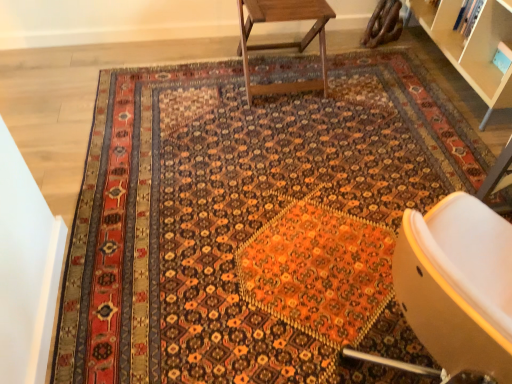
In the scene shown: In order to face matte orange chair at lower right, should I rotate leftwards or rightwards?

Turn right approximately 26.873 degrees to face it.

Describe the element at coordinates (458, 285) in the screenshot. I see `matte orange chair at lower right` at that location.

Locate an element on the screen. matte orange chair at lower right is located at coordinates (458, 285).

I want to click on wooden table at upper center, so click(x=284, y=43).

What do you see at coordinates (284, 43) in the screenshot? I see `wooden table at upper center` at bounding box center [284, 43].

The width and height of the screenshot is (512, 384). Find the location of `matte orange chair at lower right`. matte orange chair at lower right is located at coordinates (458, 285).

Would you say matte orange chair at lower right is to the left or to the right of wooden table at upper center in the picture?

Based on their positions, matte orange chair at lower right is located to the right of wooden table at upper center.

Which object is further away from the camera, matte orange chair at lower right or wooden table at upper center?

wooden table at upper center is behind.

Does point (393, 256) appear closer or farther from the camera than point (315, 82)?

Point (393, 256).

From the picture: From the image's perspective, does matte orange chair at lower right appear lower than wooden table at upper center?

Yes, from the image's perspective, matte orange chair at lower right is beneath wooden table at upper center.

From a real-world perspective, is matte orange chair at lower right located beneath wooden table at upper center?

No, from a real-world perspective, matte orange chair at lower right is not under wooden table at upper center.

Considering the sizes of objects matte orange chair at lower right and wooden table at upper center in the image provided, who is thinner, matte orange chair at lower right or wooden table at upper center?

wooden table at upper center is thinner.

Who is taller, matte orange chair at lower right or wooden table at upper center?

With more height is matte orange chair at lower right.

Considering the relative sizes of matte orange chair at lower right and wooden table at upper center in the image provided, is matte orange chair at lower right smaller than wooden table at upper center?

No.

Would you say matte orange chair at lower right is inside or outside wooden table at upper center?

matte orange chair at lower right is not enclosed by wooden table at upper center.

In the scene shown: Is matte orange chair at lower right positioned far away from wooden table at upper center?

matte orange chair at lower right is far away from wooden table at upper center.

Is matte orange chair at lower right aimed at wooden table at upper center?

No, matte orange chair at lower right is not aimed at wooden table at upper center.

What's the angular difference between matte orange chair at lower right and wooden table at upper center's facing directions?

There is a 115-degree angle between the facing directions of matte orange chair at lower right and wooden table at upper center.

Locate an element on the screen. The height and width of the screenshot is (384, 512). table that appears below the matte orange chair at lower right (from a real-world perspective) is located at coordinates (284, 43).

Which is more to the right, wooden table at upper center or matte orange chair at lower right?

Positioned to the right is matte orange chair at lower right.

Does wooden table at upper center come behind matte orange chair at lower right?

Yes, the depth of wooden table at upper center is greater than that of matte orange chair at lower right.

Is point (276, 46) more distant than point (469, 237)?

Yes, point (276, 46) is behind point (469, 237).

From the image's perspective, who appears lower, wooden table at upper center or matte orange chair at lower right?

A: matte orange chair at lower right is shown below in the image.

From a real-world perspective, is wooden table at upper center beneath matte orange chair at lower right?

Yes, from a real-world perspective, wooden table at upper center is below matte orange chair at lower right.

Looking at this image, considering the sizes of objects wooden table at upper center and matte orange chair at lower right in the image provided, who is wider, wooden table at upper center or matte orange chair at lower right?

Wider between the two is matte orange chair at lower right.

Can you confirm if wooden table at upper center is taller than matte orange chair at lower right?

In fact, wooden table at upper center may be shorter than matte orange chair at lower right.

From the picture: Is wooden table at upper center smaller than matte orange chair at lower right?

Indeed, wooden table at upper center has a smaller size compared to matte orange chair at lower right.

Is matte orange chair at lower right a part of wooden table at upper center?

No, matte orange chair at lower right is not a part of wooden table at upper center.

Is wooden table at upper center not close to matte orange chair at lower right?

Yes, wooden table at upper center is far from matte orange chair at lower right.

Is matte orange chair at lower right at the back of wooden table at upper center?

That's not correct — wooden table at upper center is not looking away from matte orange chair at lower right.

Measure the distance between wooden table at upper center and matte orange chair at lower right.

wooden table at upper center is 5.20 feet away from matte orange chair at lower right.

Where is `chair above the wooden table at upper center (from a real-world perspective)`? The width and height of the screenshot is (512, 384). chair above the wooden table at upper center (from a real-world perspective) is located at coordinates (458, 285).

At what (x,y) coordinates should I click in order to perform the action: click on chair that appears in front of the wooden table at upper center. Please return your answer as a coordinate pair (x, y). The image size is (512, 384). Looking at the image, I should click on (458, 285).

You are a GUI agent. You are given a task and a screenshot of the screen. Output one action in this format:
    pyautogui.click(x=<x>, y=<y>)
    Task: Click on the chair positioned vertically above the wooden table at upper center (from a real-world perspective)
    This screenshot has height=384, width=512.
    Given the screenshot: What is the action you would take?
    pyautogui.click(x=458, y=285)